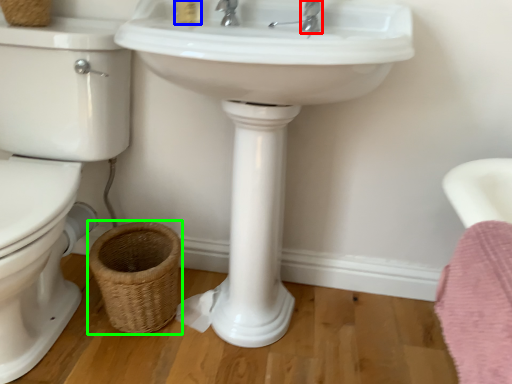
Question: Based on their relative distances, which object is farther from plumbing fixture (highlighted by a red box)? Choose from toiletry (highlighted by a blue box) and basket (highlighted by a green box).

Choices:
 (A) toiletry
 (B) basket

Answer: (B)